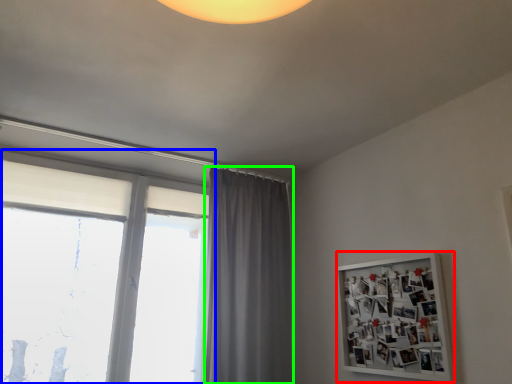
Question: Estimate the real-world distances between objects in this image. Which object is farther from bulletin board (highlighted by a red box), window (highlighted by a blue box) or curtain (highlighted by a green box)?

Choices:
 (A) window
 (B) curtain

Answer: (A)